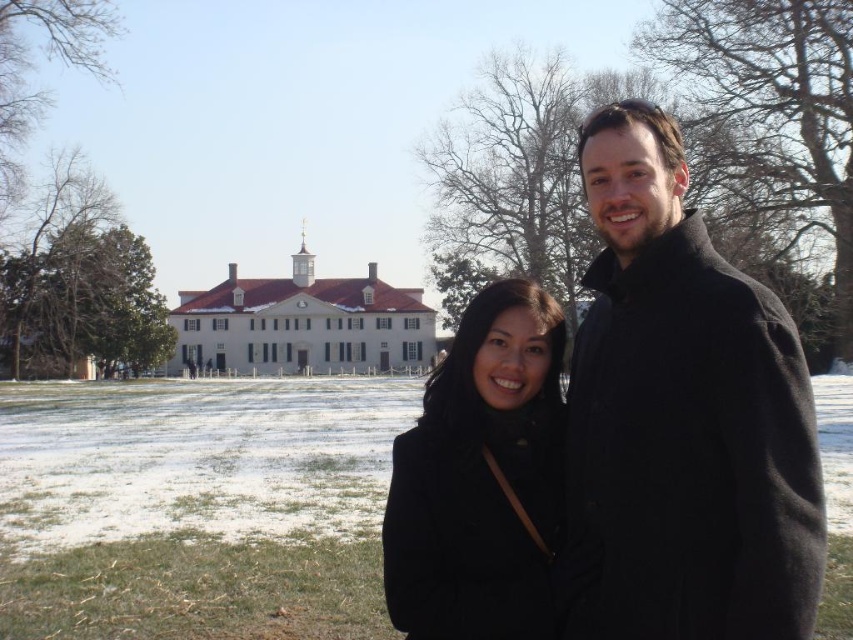
You are standing in the winter scene and want to know the exact location of the black wool coat at right. Can you tell me its coordinates?

The black wool coat at right is located at point [682,419].

You are a photographer trying to capture both the black wool coat at right and the black matte coat at center in a single frame. Based on their heights, which coat will appear larger in the photo?

The black wool coat at right is taller than the black matte coat at center, so it will appear larger in the photo.